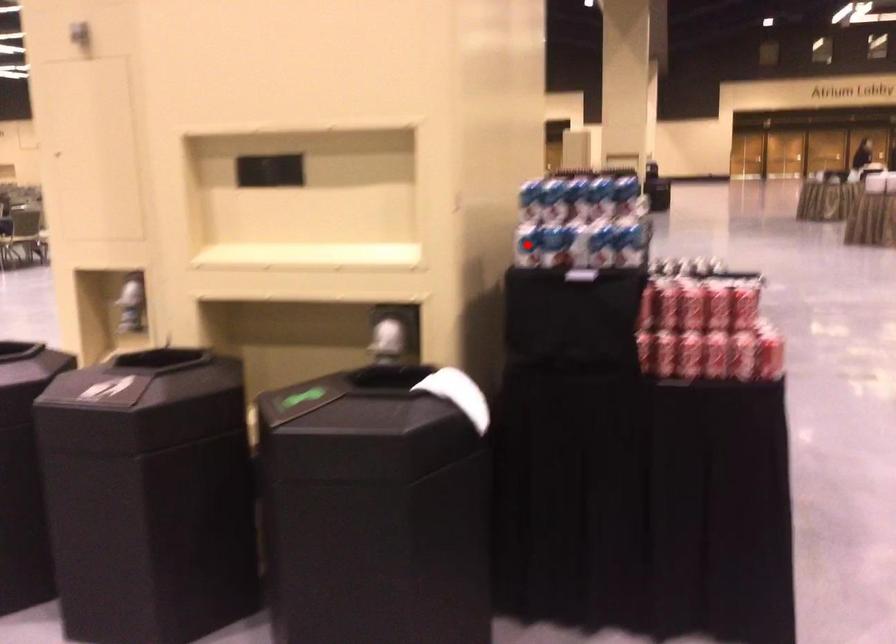
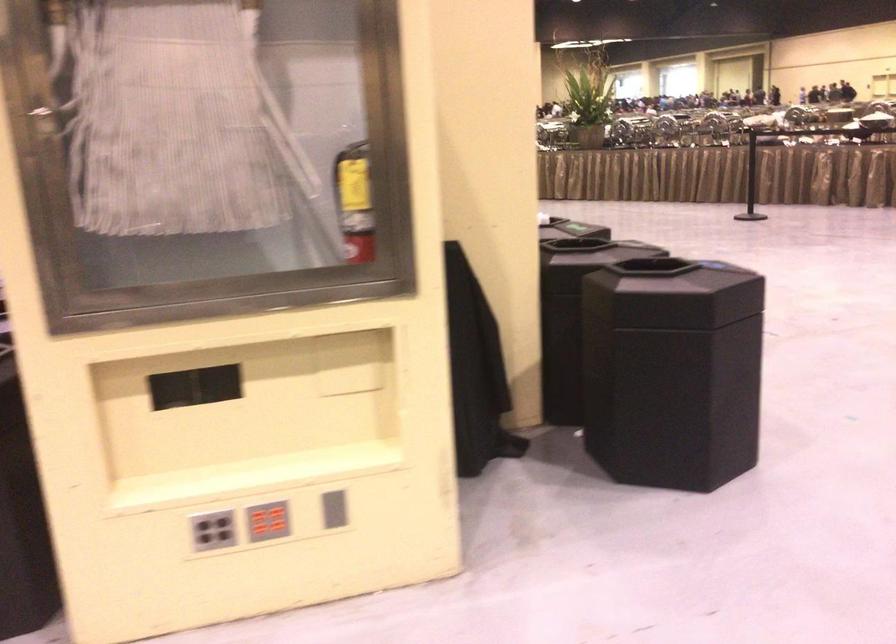
Question: I am providing you with two images of the same scene from different viewpoints. A red point is marked on the first image. Is the red point's position out of view in image 2?

Choices:
 (A) Yes
 (B) No

Answer: (A)